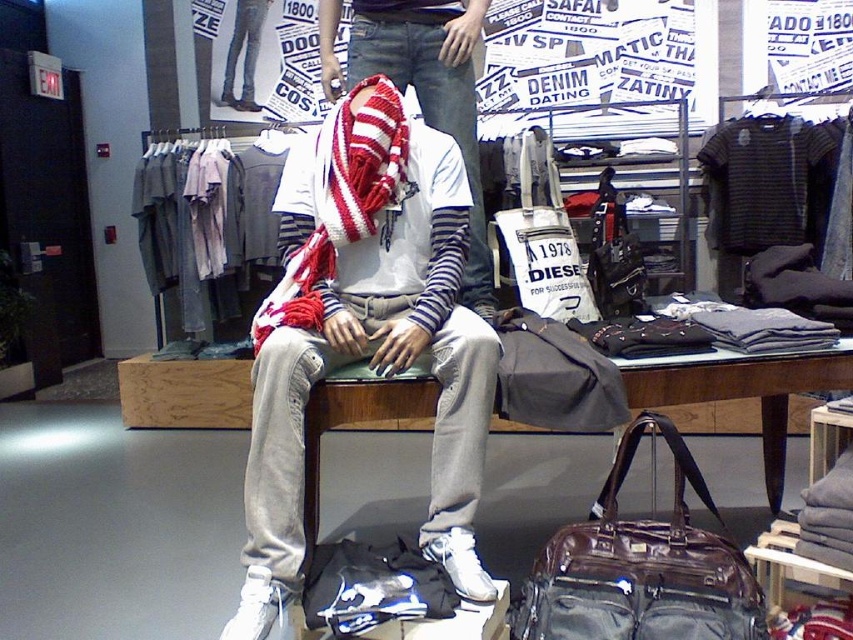
Who is lower down, leather suitcase at lower center or striped cotton scarf at center?

leather suitcase at lower center is below.

This screenshot has height=640, width=853. Find the location of `leather suitcase at lower center`. leather suitcase at lower center is located at coordinates (641, 566).

Locate an element on the screen. leather suitcase at lower center is located at coordinates (641, 566).

Who is more forward, (320,307) or (352,35)?

Point (320,307)

Looking at this image, which is more to the left, knit scarf at center or striped cotton scarf at center?

Positioned to the left is knit scarf at center.

Is point (337, 163) behind point (329, 56)?

That is False.

You are a GUI agent. You are given a task and a screenshot of the screen. Output one action in this format:
    pyautogui.click(x=<x>, y=<y>)
    Task: Click on the knit scarf at center
    
    Given the screenshot: What is the action you would take?
    click(364, 332)

Does point (357, 77) come in front of point (570, 346)?

That is False.

Who is positioned more to the right, striped cotton scarf at center or matte gray duffel bag at center?

matte gray duffel bag at center

Between point (383, 20) and point (514, 408), which one is positioned in front?

Point (514, 408)

At what (x,y) coordinates should I click in order to perform the action: click on striped cotton scarf at center. Please return your answer as a coordinate pair (x, y). This screenshot has height=640, width=853. Looking at the image, I should click on (432, 93).